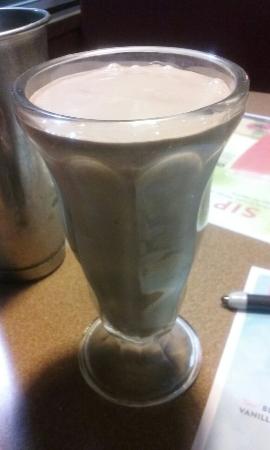
Locate an element on the screen. 1 table is located at coordinates (46, 299).